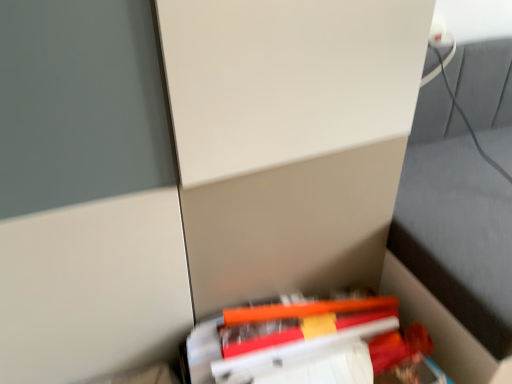
Where is `orange matte book at lower center`? The height and width of the screenshot is (384, 512). orange matte book at lower center is located at coordinates (301, 339).

What do you see at coordinates (301, 339) in the screenshot?
I see `orange matte book at lower center` at bounding box center [301, 339].

Measure the distance between point (x=260, y=332) and camera.

1.05 meters.

This screenshot has height=384, width=512. What do you see at coordinates (298, 321) in the screenshot? I see `orange matte pencil at lower center` at bounding box center [298, 321].

Find the location of a particular element. orange matte pencil at lower center is located at coordinates (298, 321).

Where is `orange matte book at lower center`? orange matte book at lower center is located at coordinates (301, 339).

Based on the photo, between orange matte book at lower center and orange matte pencil at lower center, which one appears on the right side from the viewer's perspective?

orange matte pencil at lower center.

Based on the photo, considering the relative positions of orange matte book at lower center and orange matte pencil at lower center in the image provided, is orange matte book at lower center in front of orange matte pencil at lower center?

Yes, orange matte book at lower center is closer to the camera.

Which is behind, point (309, 325) or point (395, 315)?

Positioned behind is point (395, 315).

From the image's perspective, is orange matte book at lower center above or below orange matte pencil at lower center?

Based on their image positions, orange matte book at lower center is located beneath orange matte pencil at lower center.

From a real-world perspective, is orange matte book at lower center over orange matte pencil at lower center?

Actually, orange matte book at lower center is physically below orange matte pencil at lower center in the real world.

Is orange matte book at lower center wider or thinner than orange matte pencil at lower center?

Clearly, orange matte book at lower center has more width compared to orange matte pencil at lower center.

Is orange matte book at lower center taller or shorter than orange matte pencil at lower center?

orange matte book at lower center is taller than orange matte pencil at lower center.

Which of these two, orange matte book at lower center or orange matte pencil at lower center, is bigger?

With larger size is orange matte book at lower center.

Is orange matte book at lower center positioned beyond the bounds of orange matte pencil at lower center?

orange matte book at lower center lies outside orange matte pencil at lower center's area.

Does orange matte book at lower center touch orange matte pencil at lower center?

Yes, the surface of orange matte book at lower center is in contact with orange matte pencil at lower center.

Is orange matte book at lower center oriented towards orange matte pencil at lower center?

No, orange matte book at lower center does not turn towards orange matte pencil at lower center.

Can you tell me how much orange matte book at lower center and orange matte pencil at lower center differ in facing direction?

The facing directions of orange matte book at lower center and orange matte pencil at lower center are 1.39 degrees apart.

Measure the distance from orange matte book at lower center to orange matte pencil at lower center.

A distance of 0.95 inches exists between orange matte book at lower center and orange matte pencil at lower center.

The width and height of the screenshot is (512, 384). Identify the location of book in front of the orange matte pencil at lower center. (301, 339).

Which is more to the left, orange matte pencil at lower center or orange matte book at lower center?

orange matte book at lower center.

Which is in front, orange matte pencil at lower center or orange matte book at lower center?

orange matte book at lower center.

Does point (257, 348) lie in front of point (353, 327)?

Yes.

From the image's perspective, would you say orange matte pencil at lower center is shown under orange matte book at lower center?

No.

From a real-world perspective, which object stands above the other?

From a 3D spatial view, orange matte pencil at lower center is above.

Which object is thinner, orange matte pencil at lower center or orange matte book at lower center?

Thinner between the two is orange matte pencil at lower center.

Who is shorter, orange matte pencil at lower center or orange matte book at lower center?

Standing shorter between the two is orange matte pencil at lower center.

Considering the sizes of objects orange matte pencil at lower center and orange matte book at lower center in the image provided, who is smaller, orange matte pencil at lower center or orange matte book at lower center?

orange matte pencil at lower center is smaller.

Is orange matte pencil at lower center not inside orange matte book at lower center?

That's correct, orange matte pencil at lower center is outside of orange matte book at lower center.

Are orange matte pencil at lower center and orange matte book at lower center located far from each other?

orange matte pencil at lower center is actually quite close to orange matte book at lower center.

Is orange matte pencil at lower center oriented towards orange matte book at lower center?

No, orange matte pencil at lower center is not facing towards orange matte book at lower center.

Locate an element on the screen. This screenshot has width=512, height=384. book beneath the orange matte pencil at lower center (from a real-world perspective) is located at coordinates (301, 339).

The width and height of the screenshot is (512, 384). In order to click on book that appears below the orange matte pencil at lower center (from the image's perspective) in this screenshot , I will do point(301,339).

At what (x,y) coordinates should I click in order to perform the action: click on book on the left of orange matte pencil at lower center. Please return your answer as a coordinate pair (x, y). This screenshot has height=384, width=512. Looking at the image, I should click on (301, 339).